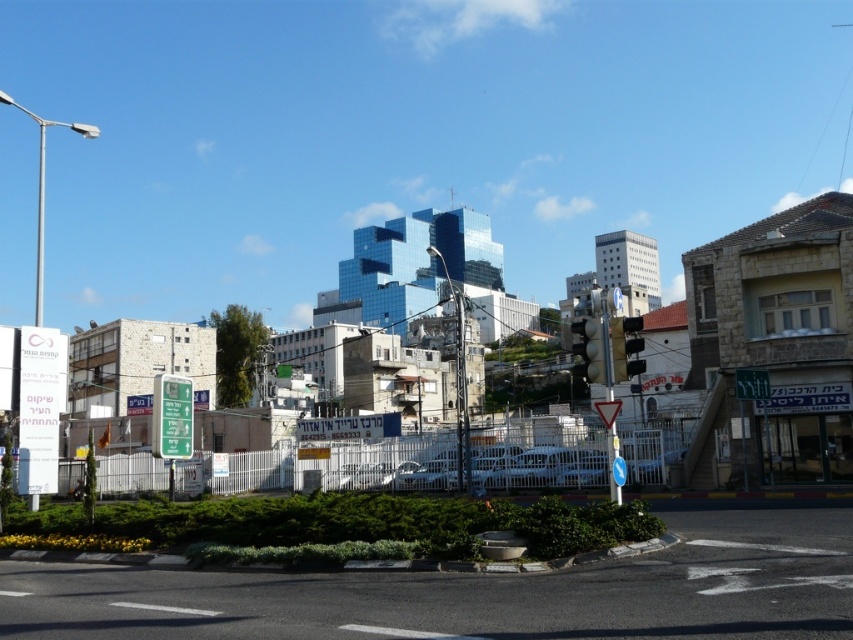
Can you confirm if green plastic sign at lower left is positioned to the left of metallic traffic light at center?

Yes, green plastic sign at lower left is to the left of metallic traffic light at center.

Does green plastic sign at lower left have a lesser width compared to metallic traffic light at center?

Yes.

Who is more distant from viewer, [180,384] or [596,358]?

Point [180,384]

Identify the location of green plastic sign at lower left. (172, 417).

Does metallic traffic light at center-right appear under metallic traffic light at center?

No.

Can you confirm if metallic traffic light at center-right is positioned to the right of metallic traffic light at center?

In fact, metallic traffic light at center-right is to the left of metallic traffic light at center.

Between point (618, 365) and point (590, 324), which one is positioned behind?

Positioned behind is point (590, 324).

This screenshot has height=640, width=853. Identify the location of metallic traffic light at center-right. (625, 346).

Between green plastic sign at lower left and metallic traffic light at center-right, which one appears on the right side from the viewer's perspective?

Positioned to the right is metallic traffic light at center-right.

Does green plastic sign at lower left appear on the left side of metallic traffic light at center-right?

Indeed, green plastic sign at lower left is positioned on the left side of metallic traffic light at center-right.

Image resolution: width=853 pixels, height=640 pixels. Describe the element at coordinates (172, 417) in the screenshot. I see `green plastic sign at lower left` at that location.

Locate an element on the screen. The height and width of the screenshot is (640, 853). green plastic sign at lower left is located at coordinates (172, 417).